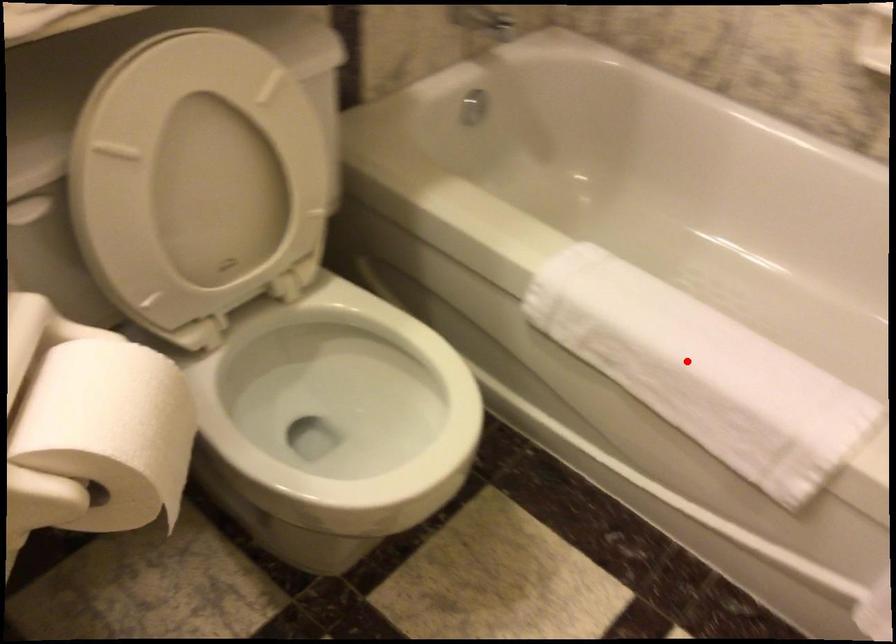
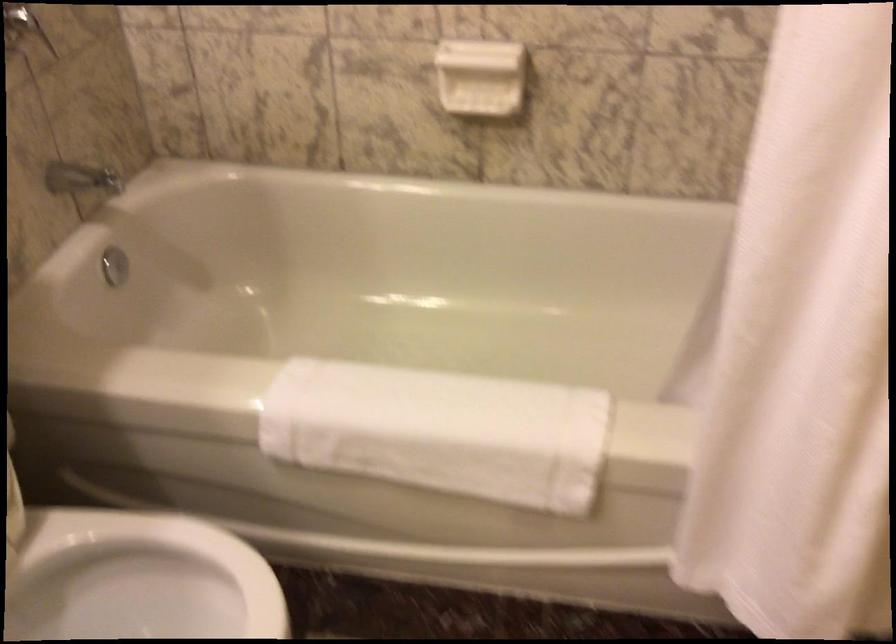
Find the pixel in the second image that matches the highlighted location in the first image.

(440, 431)